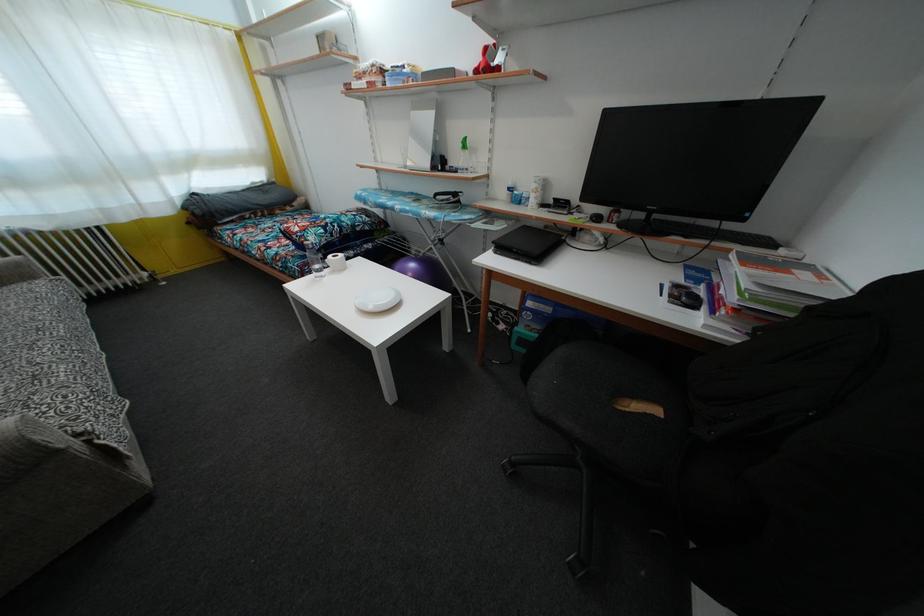
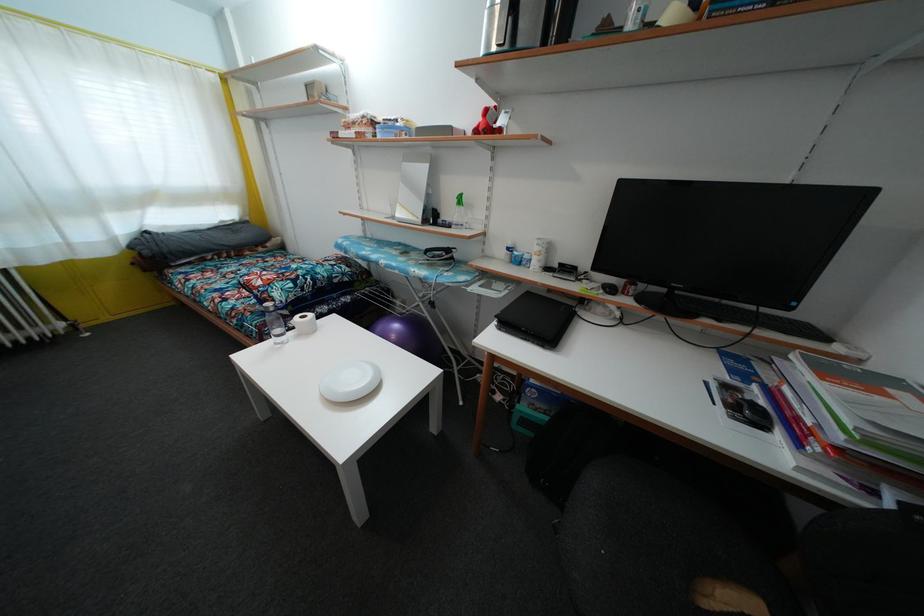
Question: I am providing you with two images of the same scene from different viewpoints. Which of the following objects are not visible in image2?

Choices:
 (A) toilet paper roll
 (B) black iron handle
 (C) chair sitting surface
 (D) none of these

Answer: (D)